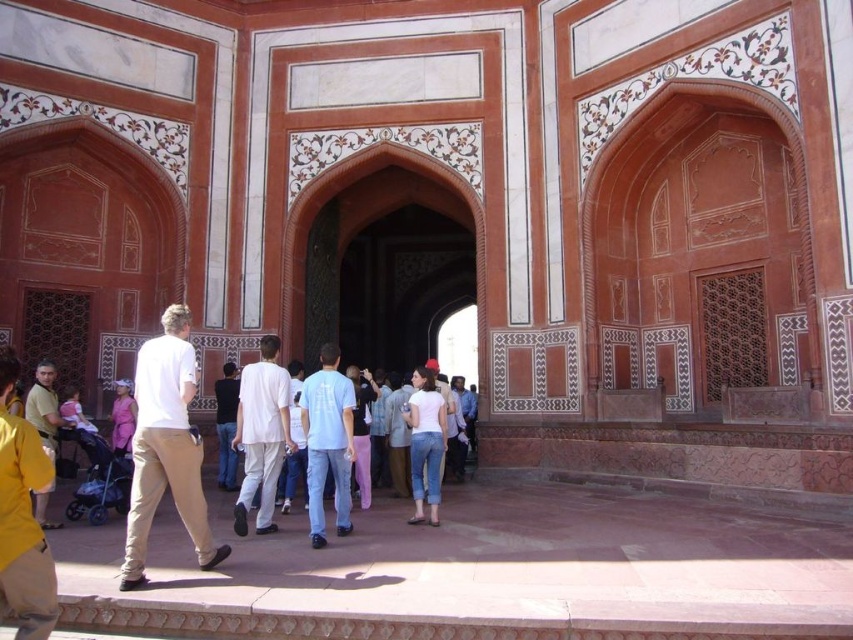
Can you confirm if white cotton shirt at center is positioned to the right of light blue cotton shirt at center?

Incorrect, white cotton shirt at center is not on the right side of light blue cotton shirt at center.

Which is below, white cotton shirt at center or light blue cotton shirt at center?

light blue cotton shirt at center is lower down.

Measure the distance between white cotton shirt at center and camera.

white cotton shirt at center and camera are 22.24 meters apart from each other.

The width and height of the screenshot is (853, 640). Find the location of `white cotton shirt at center`. white cotton shirt at center is located at coordinates (260, 435).

Is point (36, 428) positioned behind point (375, 384)?

No, (36, 428) is closer to viewer.

Which of these two, matte khaki shirt at lower left or light blue cotton shirt at center, stands shorter?

Standing shorter between the two is light blue cotton shirt at center.

Find the location of a particular element. matte khaki shirt at lower left is located at coordinates (44, 406).

Where is `matte khaki shirt at lower left`? The height and width of the screenshot is (640, 853). matte khaki shirt at lower left is located at coordinates (44, 406).

Does white cotton shirt at center appear over light blue denim jeans at center?

Indeed, white cotton shirt at center is positioned over light blue denim jeans at center.

Between white cotton shirt at center and light blue denim jeans at center, which one has more height?

With more height is white cotton shirt at center.

This screenshot has height=640, width=853. Describe the element at coordinates (260, 435) in the screenshot. I see `white cotton shirt at center` at that location.

You are a GUI agent. You are given a task and a screenshot of the screen. Output one action in this format:
    pyautogui.click(x=<x>, y=<y>)
    Task: Click on the white cotton shirt at center
    This screenshot has width=853, height=640.
    Given the screenshot: What is the action you would take?
    pyautogui.click(x=260, y=435)